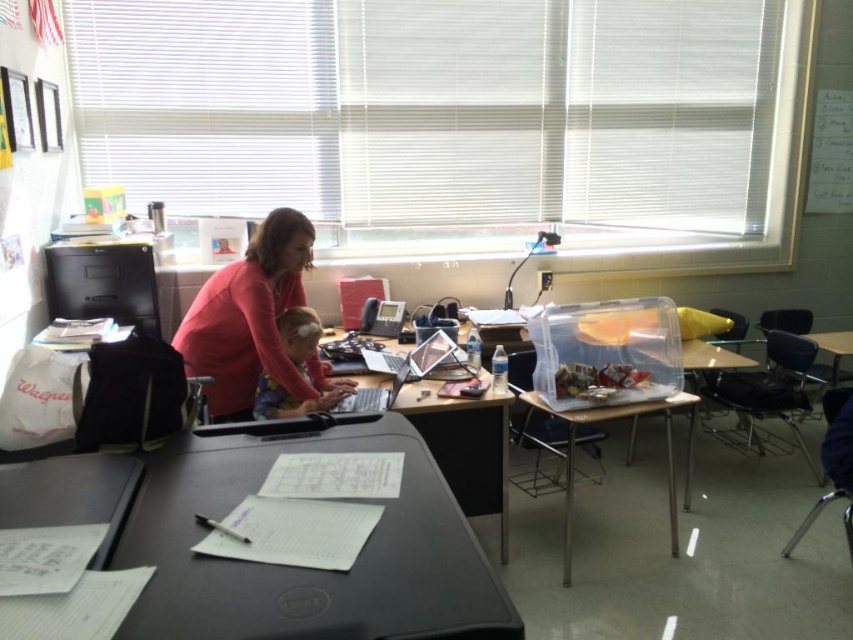
Can you confirm if matte pink sweater at center is wider than matte plastic laptop at center?

Yes.

Who is more distant from viewer, (234,392) or (303,339)?

The point (234,392) is behind.

The width and height of the screenshot is (853, 640). Find the location of `matte pink sweater at center`. matte pink sweater at center is located at coordinates point(252,321).

Which is behind, point (225, 340) or point (410, 410)?

The point (225, 340) is more distant.

At what (x,y) coordinates should I click in order to perform the action: click on matte pink sweater at center. Please return your answer as a coordinate pair (x, y). This screenshot has height=640, width=853. Looking at the image, I should click on (252, 321).

Can you confirm if clear plastic container at center is taller than matte plastic laptop at center?

Yes, clear plastic container at center is taller than matte plastic laptop at center.

Does point (567, 476) lie behind point (300, 403)?

No, it is in front of (300, 403).

Find the location of a particular element. The height and width of the screenshot is (640, 853). clear plastic container at center is located at coordinates (625, 454).